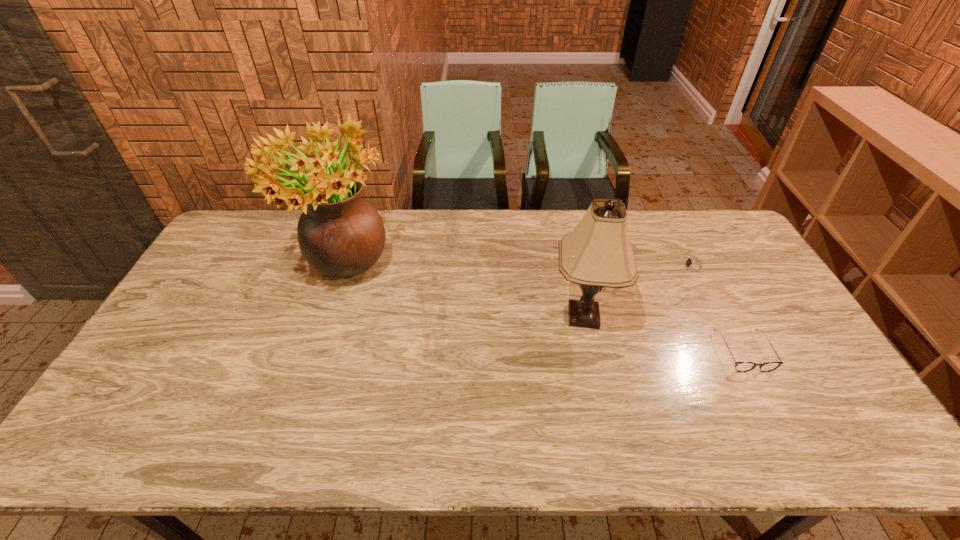
The image size is (960, 540). Find the location of `blank space located 0.390m on the face of the watch`. blank space located 0.390m on the face of the watch is located at coordinates (561, 266).

Locate an element on the screen. This screenshot has width=960, height=540. object that is at the far edge is located at coordinates (340, 234).

At what (x,y) coordinates should I click in order to perform the action: click on spectacles positioned at the right edge. Please return your answer as a coordinate pair (x, y). This screenshot has height=540, width=960. Looking at the image, I should click on (739, 366).

Locate an element on the screen. watch that is at the right edge is located at coordinates (692, 265).

Locate an element on the screen. Image resolution: width=960 pixels, height=540 pixels. vacant space at the far edge is located at coordinates (445, 242).

Image resolution: width=960 pixels, height=540 pixels. In order to click on free region at the near edge of the desktop in this screenshot , I will do `click(655, 446)`.

This screenshot has width=960, height=540. In the image, there is a desktop. In order to click on vacant space at the left edge in this screenshot , I will do `click(145, 418)`.

This screenshot has height=540, width=960. What are the coordinates of `free space at the far right corner of the desktop` in the screenshot? It's located at (715, 228).

At what (x,y) coordinates should I click in order to perform the action: click on free space that is in between the leftmost object and the third object from right to left. Please return your answer as a coordinate pair (x, y). Image resolution: width=960 pixels, height=540 pixels. Looking at the image, I should click on (464, 294).

This screenshot has height=540, width=960. I want to click on empty space that is in between the third tallest object and the shortest object, so click(x=718, y=309).